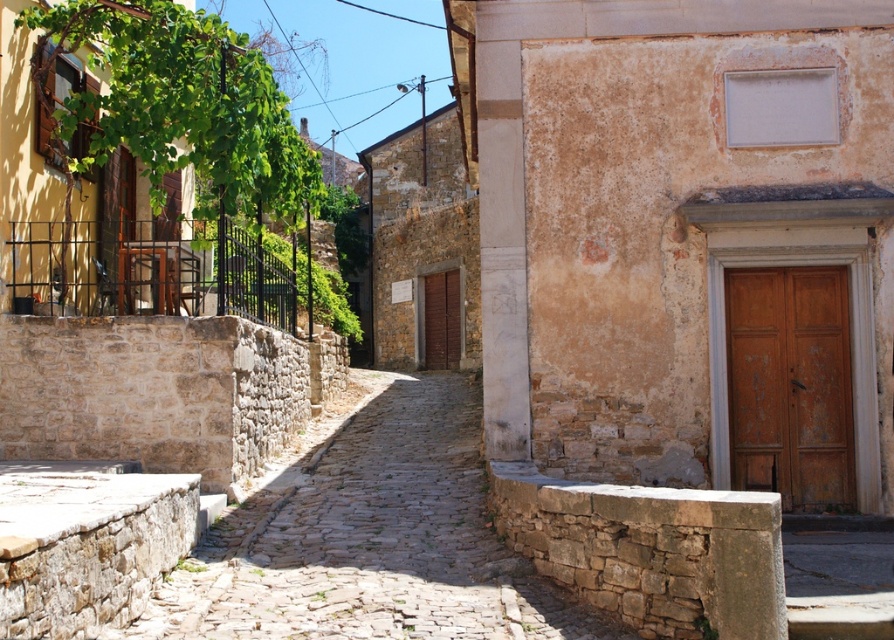
Is wooden door at right above brown wooden door at center?

Actually, wooden door at right is below brown wooden door at center.

Between point (772, 291) and point (447, 282), which one is positioned behind?

The point (447, 282) is behind.

You are a GUI agent. You are given a task and a screenshot of the screen. Output one action in this format:
    pyautogui.click(x=<x>, y=<y>)
    Task: Click on the wooden door at right
    This screenshot has height=640, width=894.
    Given the screenshot: What is the action you would take?
    pyautogui.click(x=790, y=385)